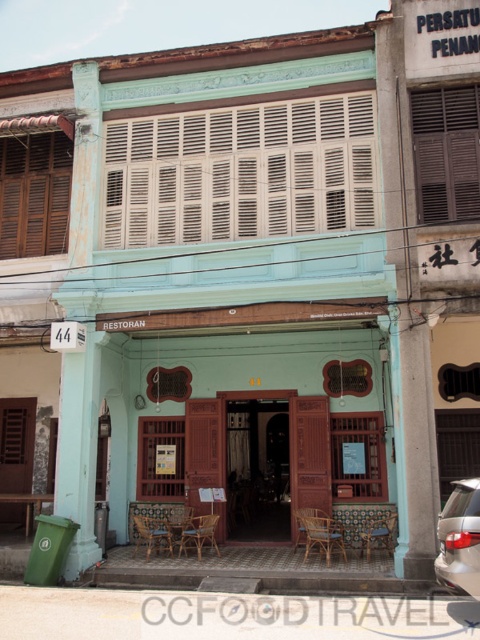
You are standing at the entrance of the restaurant and notice two points marked on the ground. The first point is at coordinate point (x=457, y=548) and the second is at point (x=181, y=536). Which point is closer to you as you face the entrance?

Point (x=457, y=548) is in front of point (x=181, y=536), so it is closer to you when facing the entrance.

You are standing at the entrance of the restaurant. There is a satin silver car represented by point (459,538). Where is the car located relative to the entrance?

The satin silver car at lower right is represented by point (459,538), so it is located to the lower right of the entrance.